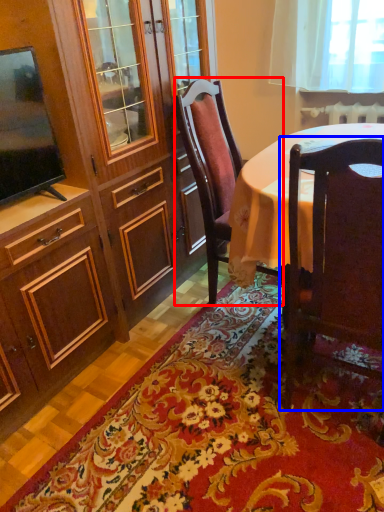
Question: Which object is closer to the camera taking this photo, chair (highlighted by a red box) or chair (highlighted by a blue box)?

Choices:
 (A) chair
 (B) chair

Answer: (B)